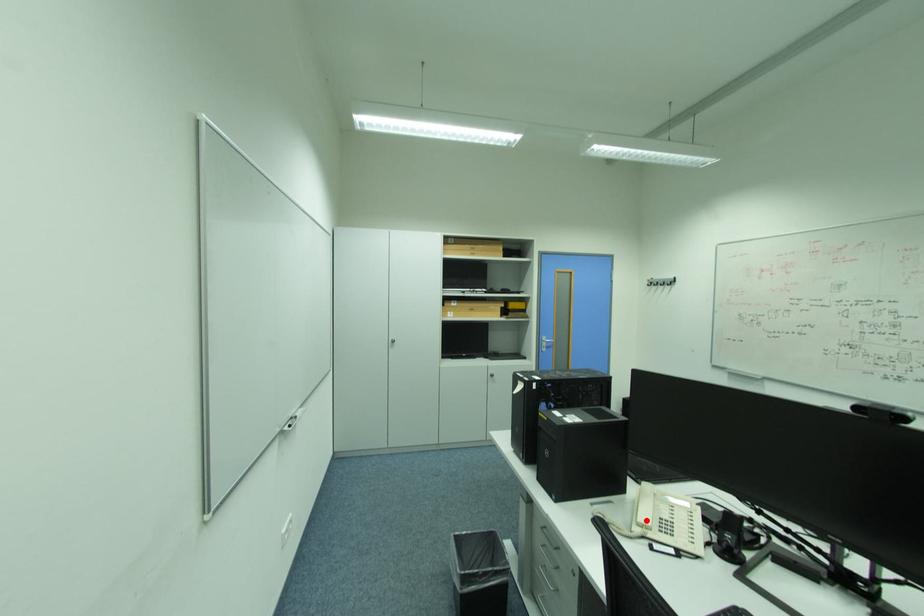
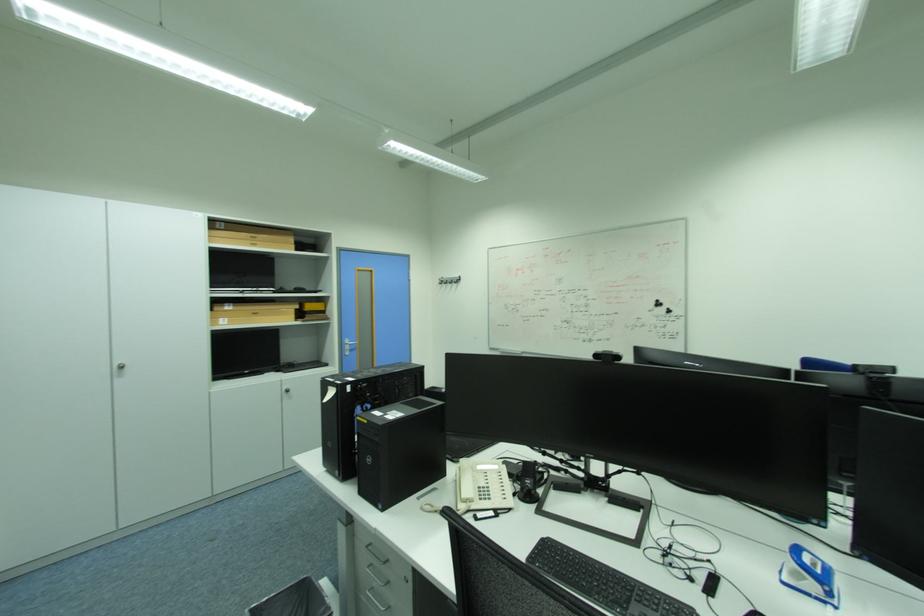
Locate, in the second image, the point that corresponds to the highlighted location in the first image.

(470, 496)